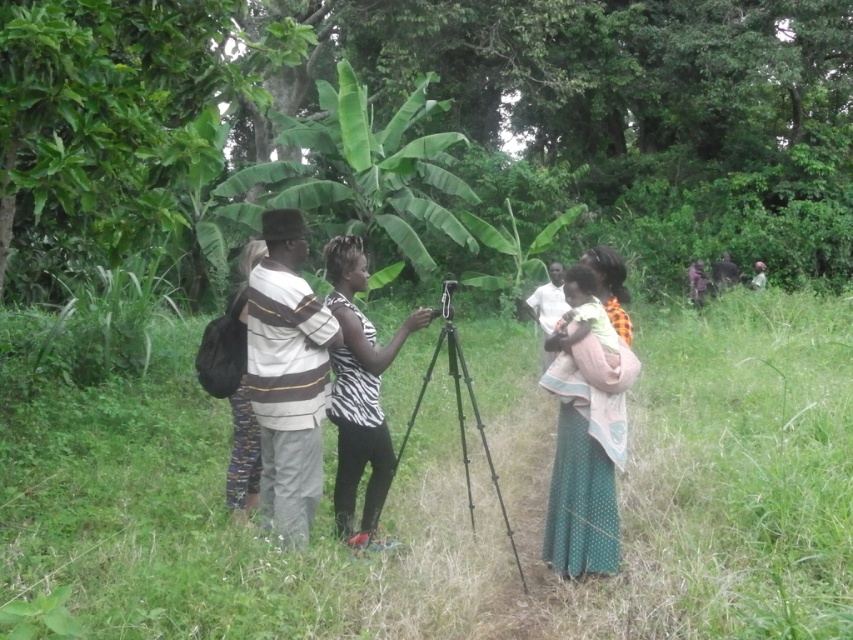
Looking at this image, can you confirm if black matte tripod at center is thinner than dark brown leather jacket at right?

Incorrect, black matte tripod at center's width is not less than dark brown leather jacket at right's.

Is black matte tripod at center behind dark brown leather jacket at right?

No, it is not.

Who is more distant from viewer, [497,483] or [699,289]?

The point [699,289] is more distant.

Locate an element on the screen. black matte tripod at center is located at coordinates (460, 412).

Does striped cotton shirt at center appear under white fabric at center?

Correct, striped cotton shirt at center is located below white fabric at center.

Between point (285, 307) and point (758, 272), which one is positioned behind?

Point (758, 272)

What do you see at coordinates (287, 376) in the screenshot? I see `striped cotton shirt at center` at bounding box center [287, 376].

You are a GUI agent. You are given a task and a screenshot of the screen. Output one action in this format:
    pyautogui.click(x=<x>, y=<y>)
    Task: Click on the striped cotton shirt at center
    This screenshot has width=853, height=640.
    Given the screenshot: What is the action you would take?
    pyautogui.click(x=287, y=376)

Who is taller, green textured skirt at center or striped fabric shirt at center?

Standing taller between the two is green textured skirt at center.

Between green textured skirt at center and striped fabric shirt at center, which one appears on the left side from the viewer's perspective?

striped fabric shirt at center is more to the left.

Who is more distant from viewer, (x=566, y=372) or (x=245, y=512)?

The point (x=245, y=512) is more distant.

Image resolution: width=853 pixels, height=640 pixels. Find the location of `green textured skirt at center`. green textured skirt at center is located at coordinates (585, 432).